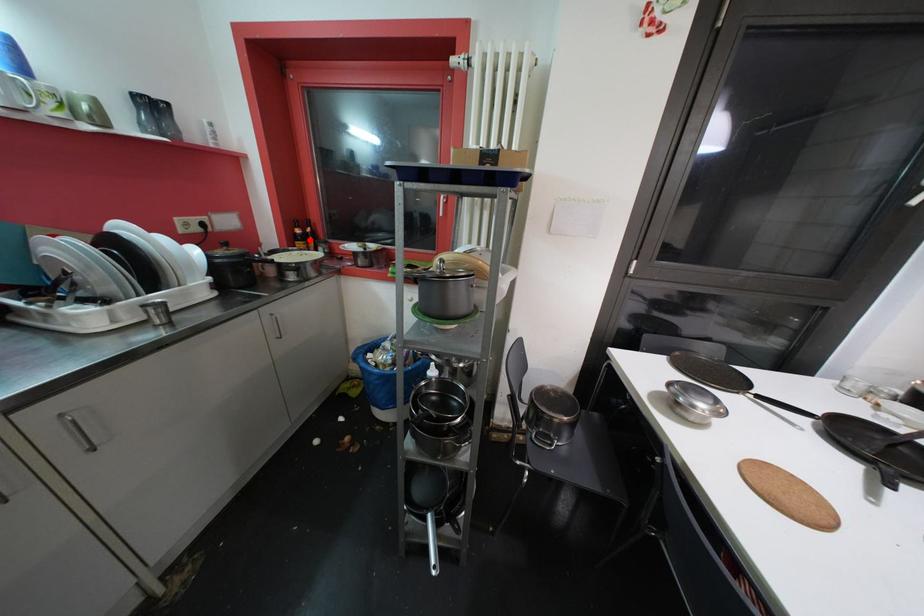
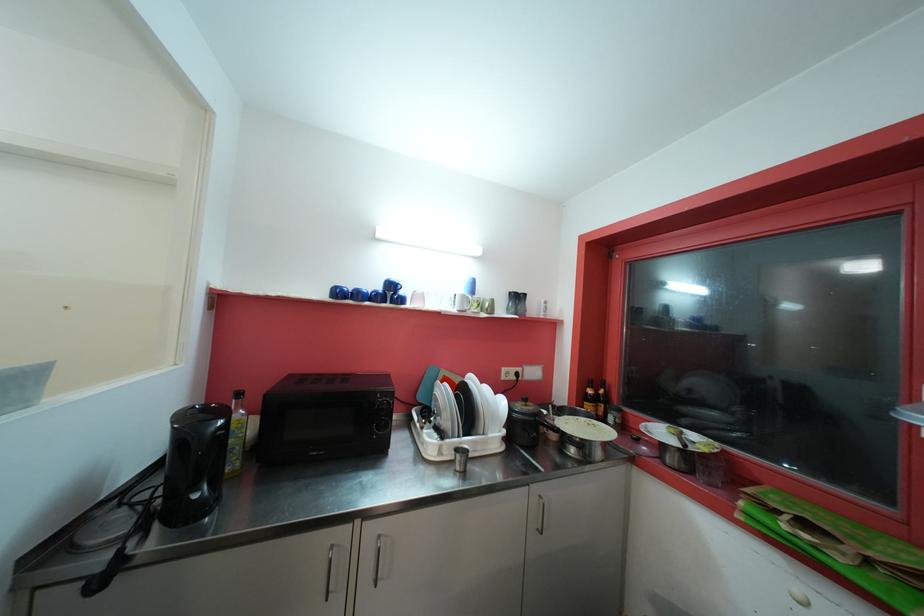
Locate, in the second image, the point that corresponds to the highlighted location in the first image.

(601, 402)